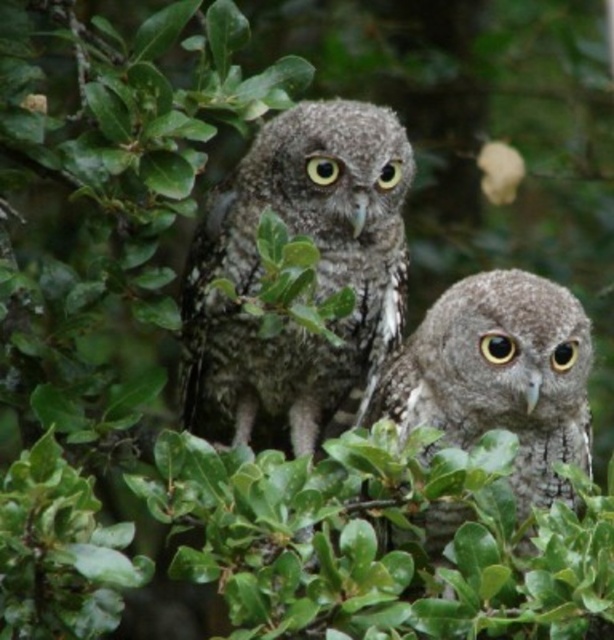
You are a birdwatcher trying to capture both the speckled feather owl at center and the speckled gray owl at center in a single photo. Given that your camera has a maximum focus range of 10 inches, will you be able to focus on both owls simultaneously?

The speckled feather owl at center and the speckled gray owl at center are 10.32 inches apart. Since the distance between them exceeds the camera focus range of 10 inches, you may not be able to focus on both simultaneously.

You are a birdwatcher observing two owls in the image. You notice that one of them is larger. Which owl is bigger between the speckled feather owl at center and the speckled gray owl at center?

The speckled feather owl at center is larger in size than the speckled gray owl at center.

You are a photographer standing 1.5 meters away from a tree. You want to take a photo of the speckled feather owl at center. Can you get a clear closeup shot without moving closer than your current position?

The speckled feather owl at center is 2.49 meters away from the camera. Since you are currently 1.5 meters away from the tree, you are closer than the required distance for the owl. Therefore, you can get a clear closeup shot without needing to move closer.